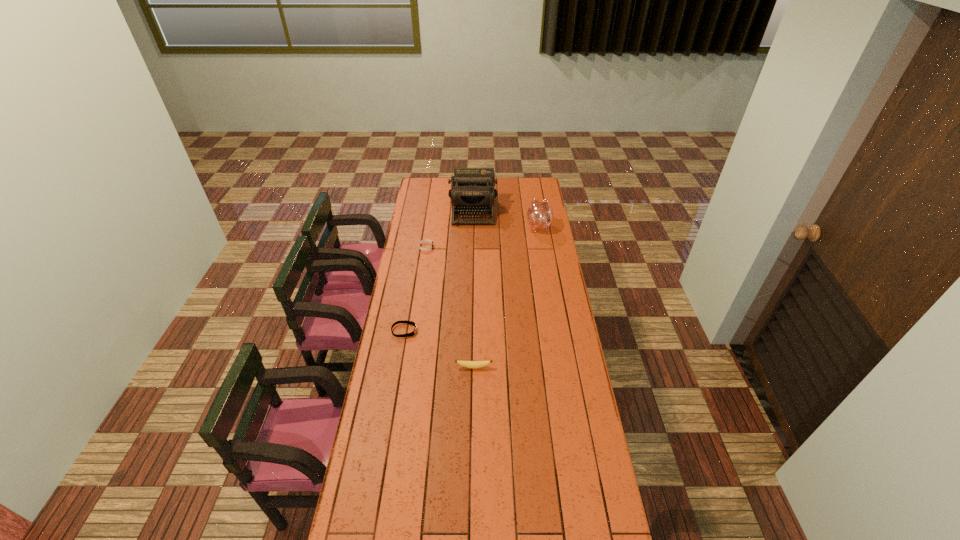
Point out which object is positioned as the nearest to the piggy bank. Please provide its 2D coordinates. Your answer should be formatted as a tuple, i.e. [(x, y)], where the tuple contains the x and y coordinates of a point satisfying the conditions above.

[(472, 192)]

Select which wristband is the second closest to the typewriter. Please provide its 2D coordinates. Your answer should be formatted as a tuple, i.e. [(x, y)], where the tuple contains the x and y coordinates of a point satisfying the conditions above.

[(404, 321)]

Identify the location of the closest wristband relative to the banana. This screenshot has width=960, height=540. (404, 321).

Locate an element on the screen. The height and width of the screenshot is (540, 960). vacant space that satisfies the following two spatial constraints: 1. on the display of the second nearest object; 2. on the back side of the third shortest object is located at coordinates (398, 367).

Locate an element on the screen. This screenshot has height=540, width=960. vacant space that satisfies the following two spatial constraints: 1. on the display of the nearer wristband; 2. on the back side of the third shortest object is located at coordinates (398, 367).